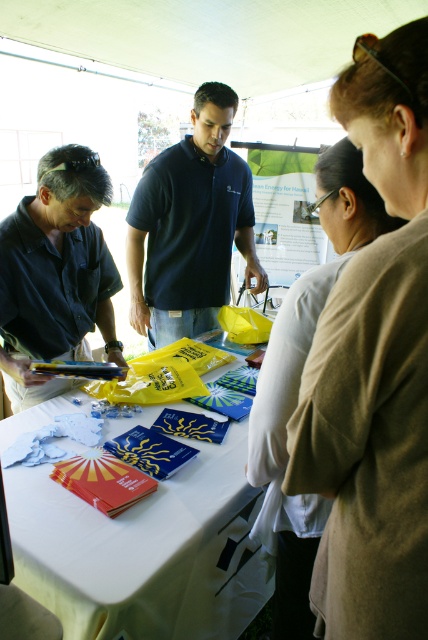
You are organizing an outdoor event and need to hand out promotional materials. There are two people at the table wearing a dark blue polo shirt at center and a light beige sweater at center. Which person should you approach if you need someone to carry a large stack of brochures, considering their clothing size?

The dark blue polo shirt at center has a larger size compared to light beige sweater at center, so you should approach the person wearing the dark blue polo shirt at center as they might have more space in their clothing to carry the large stack of brochures.

You are organizing a community event and need to decide which attendee to hand out a large poster to. The poster requires someone with a wider torso to hold it. Between the matte black shirt at left and the light beige sweater at center, which attendee should you choose?

The matte black shirt at left has a greater width than the light beige sweater at center, so you should choose the attendee wearing the matte black shirt at left to hold the large poster as they have a wider torso.

You are standing at the point labeled as point (290, 609) and want to walk to the entrance of the tent, which is located behind the table. There is an obstacle at point (243, 236). Can you safely walk around the obstacle to reach the entrance without going off the path?

Point (243, 236) is behind point (290, 609), so the obstacle is already behind you. Therefore, you can safely walk towards the entrance without needing to go around the obstacle.